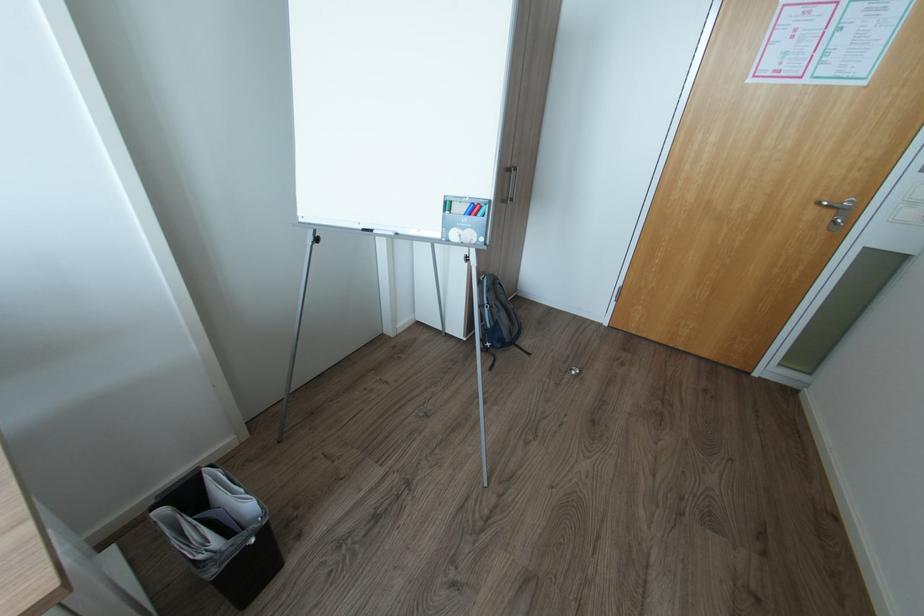
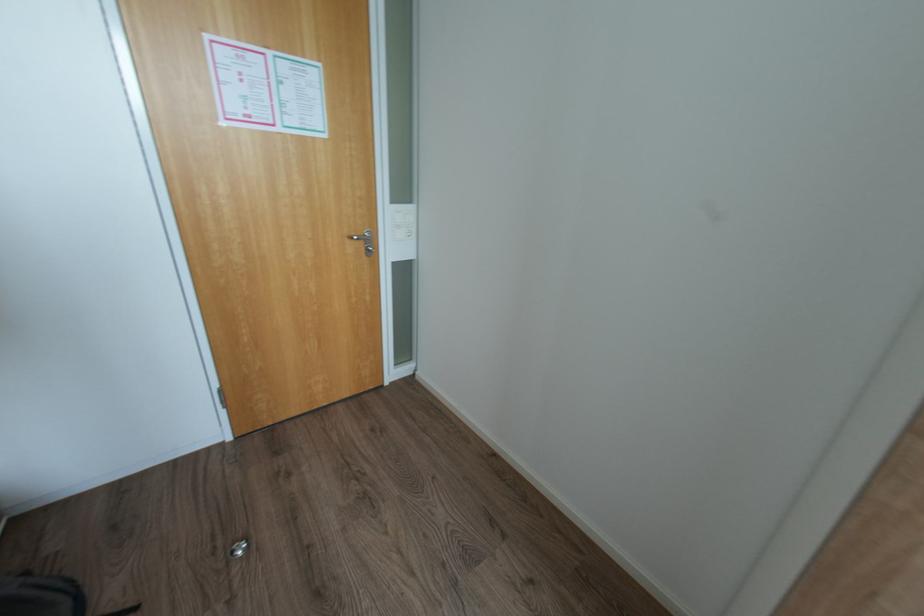
Question: Based on the continuous images, in which direction is the camera rotating? Reply with the corresponding letter.

Choices:
 (A) Left
 (B) Right
 (C) Up
 (D) Down

Answer: (B)